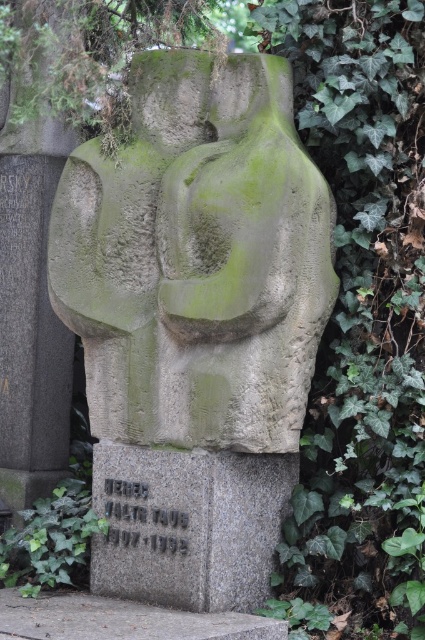
Question: Does green mossy stone sculpture at center have a larger size compared to green mossy stone at lower left?

Choices:
 (A) yes
 (B) no

Answer: (A)

Question: Which object appears farthest from the camera in this image?

Choices:
 (A) granite stone at center
 (B) green ivy at center
 (C) green mossy stone at lower left
 (D) green mossy stone sculpture at center

Answer: (C)

Question: Is the position of green mossy stone sculpture at center less distant than that of green ivy at center?

Choices:
 (A) yes
 (B) no

Answer: (B)

Question: Considering the relative positions of green ivy at center and granite stone at center in the image provided, where is green ivy at center located with respect to granite stone at center?

Choices:
 (A) left
 (B) right

Answer: (B)

Question: Among these objects, which one is farthest from the camera?

Choices:
 (A) green mossy stone sculpture at center
 (B) green mossy stone at lower left

Answer: (B)

Question: Which object is the closest to the green ivy at center?

Choices:
 (A) granite stone at center
 (B) green mossy stone at lower left
 (C) green mossy stone sculpture at center

Answer: (C)